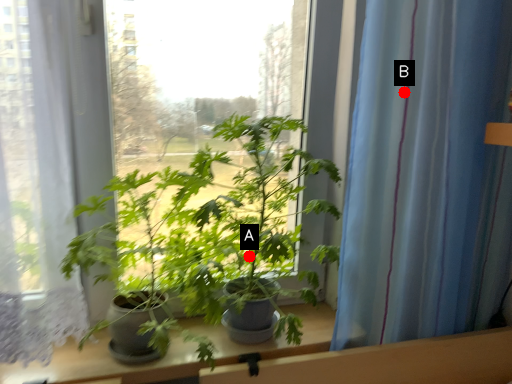
Question: Two points are circled on the image, labeled by A and B beside each circle. Which of the following is the farthest from the observer?

Choices:
 (A) A is further
 (B) B is further

Answer: (A)